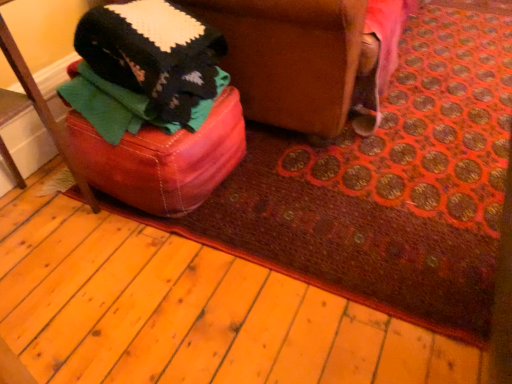
Question: Can you confirm if leather ottoman at lower left is positioned to the left of leather ottoman at left?

Choices:
 (A) no
 (B) yes

Answer: (A)

Question: Is leather ottoman at lower left looking in the opposite direction of leather ottoman at left?

Choices:
 (A) no
 (B) yes

Answer: (A)

Question: Does leather ottoman at lower left have a larger size compared to leather ottoman at left?

Choices:
 (A) no
 (B) yes

Answer: (B)

Question: From the image's perspective, is leather ottoman at lower left located above leather ottoman at left?

Choices:
 (A) no
 (B) yes

Answer: (B)

Question: Does leather ottoman at lower left turn towards leather ottoman at left?

Choices:
 (A) yes
 (B) no

Answer: (B)

Question: Is leather ottoman at lower left wider than leather ottoman at left?

Choices:
 (A) no
 (B) yes

Answer: (B)

Question: From a real-world perspective, is leather ottoman at left physically below leather ottoman at lower left?

Choices:
 (A) yes
 (B) no

Answer: (B)

Question: Is leather ottoman at left wider than leather ottoman at lower left?

Choices:
 (A) yes
 (B) no

Answer: (B)

Question: From the image's perspective, is leather ottoman at left over leather ottoman at lower left?

Choices:
 (A) yes
 (B) no

Answer: (B)

Question: Can you confirm if leather ottoman at left is shorter than leather ottoman at lower left?

Choices:
 (A) no
 (B) yes

Answer: (A)

Question: Are leather ottoman at left and leather ottoman at lower left located far from each other?

Choices:
 (A) yes
 (B) no

Answer: (B)

Question: Is leather ottoman at left to the right of leather ottoman at lower left from the viewer's perspective?

Choices:
 (A) yes
 (B) no

Answer: (B)

Question: In terms of size, does leather ottoman at lower left appear bigger or smaller than leather ottoman at left?

Choices:
 (A) small
 (B) big

Answer: (B)